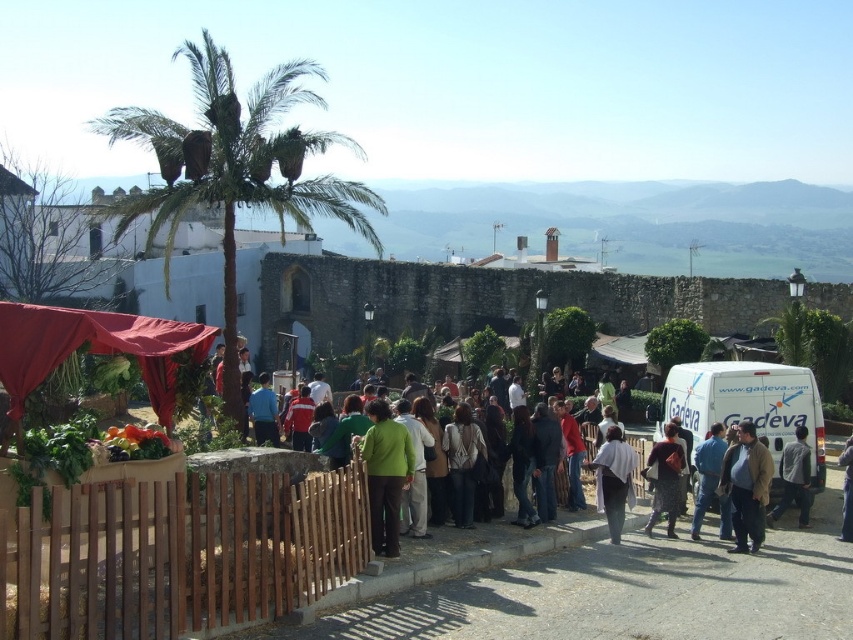
Question: Is green matte jacket at center wider than blue denim jeans at center?

Choices:
 (A) no
 (B) yes

Answer: (A)

Question: Is white cotton shirt at center below denim jacket at lower right?

Choices:
 (A) yes
 (B) no

Answer: (B)

Question: In this image, where is blue fabric shirt at center located relative to denim jacket at lower right?

Choices:
 (A) below
 (B) above

Answer: (B)

Question: Which object is positioned closest to the light gray fabric jacket at lower right?

Choices:
 (A) blue fabric shirt at center
 (B) dark brown fabric dress at center
 (C) white matte van at center-right
 (D) brown textured jacket at center

Answer: (C)

Question: Considering the real-world distances, which object is closest to the light gray fabric jacket at lower right?

Choices:
 (A) green fabric jacket at center
 (B) blue fabric shirt at center

Answer: (A)

Question: Which point is farther to the camera?

Choices:
 (A) white matte van at center-right
 (B) brown wooden fence at lower left
 (C) dark brown fabric dress at center

Answer: (A)